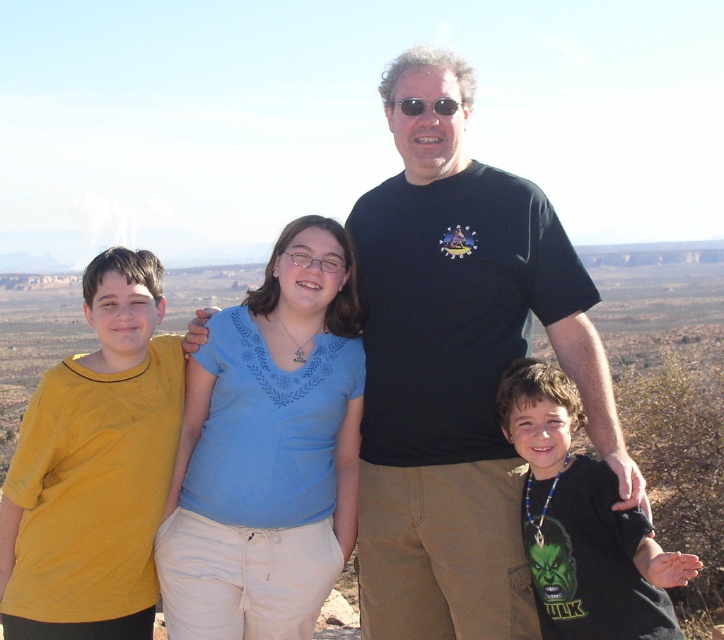
Question: Which object is closer to the camera taking this photo?

Choices:
 (A) blue cotton shirt at center
 (B) black matte shirt at lower right
 (C) yellow cotton shirt at left

Answer: (B)

Question: Can you confirm if blue cotton shirt at center is wider than black matte shirt at lower right?

Choices:
 (A) no
 (B) yes

Answer: (A)

Question: Does black cotton t-shirt at center come in front of yellow cotton shirt at left?

Choices:
 (A) yes
 (B) no

Answer: (A)

Question: Which of the following is the closest to the observer?

Choices:
 (A) [x=230, y=531]
 (B) [x=460, y=531]
 (C) [x=563, y=506]
 (D) [x=85, y=387]

Answer: (C)

Question: Which object is closer to the camera taking this photo?

Choices:
 (A) black cotton t-shirt at center
 (B) blue cotton shirt at center

Answer: (A)

Question: Observing the image, what is the correct spatial positioning of black cotton t-shirt at center in reference to blue cotton shirt at center?

Choices:
 (A) left
 (B) right

Answer: (B)